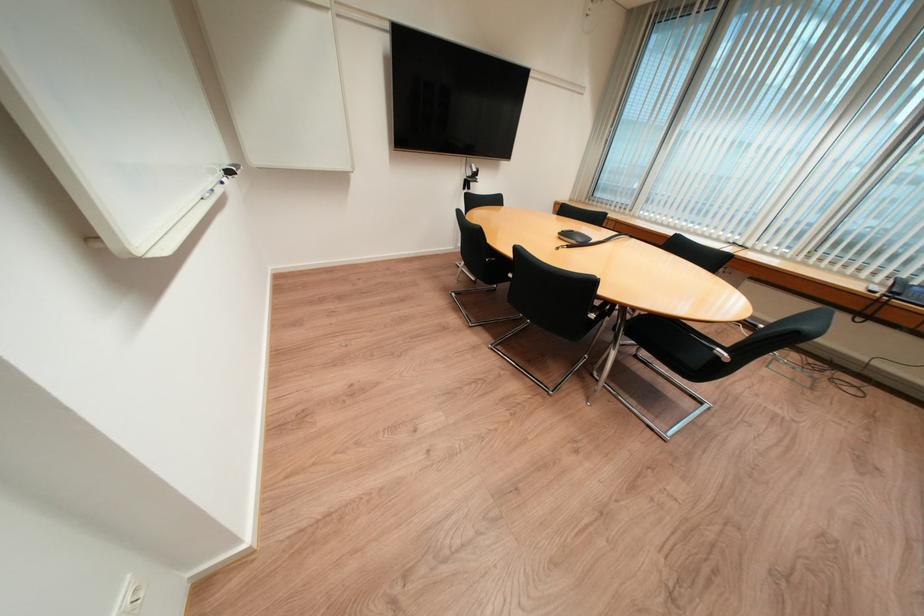
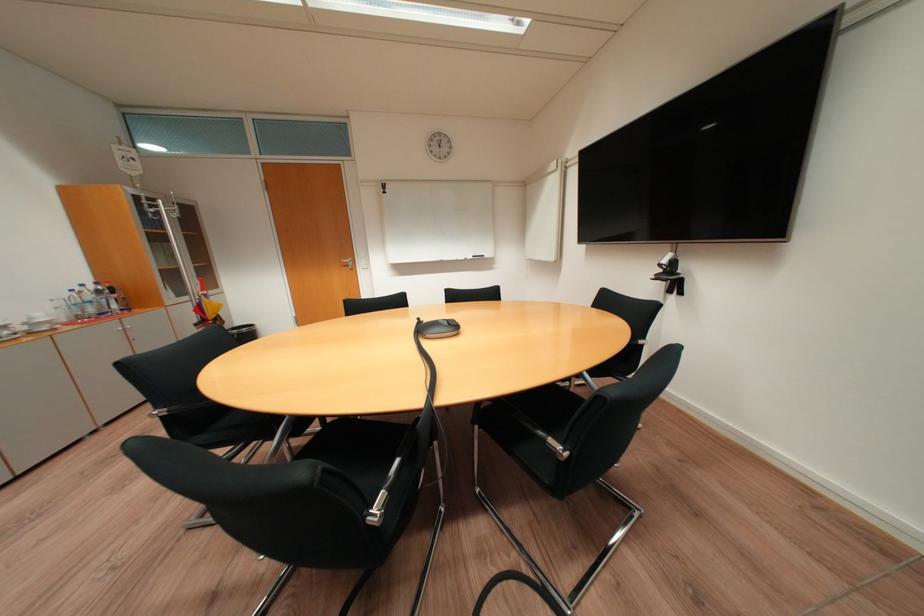
Question: I am providing you with two images of the same scene from different viewpoints. Which of the following objects are not visible in image2?

Choices:
 (A) white router box
 (B) metallic chair armrest
 (C) chrome chair armrest
 (D) black trash can

Answer: (C)